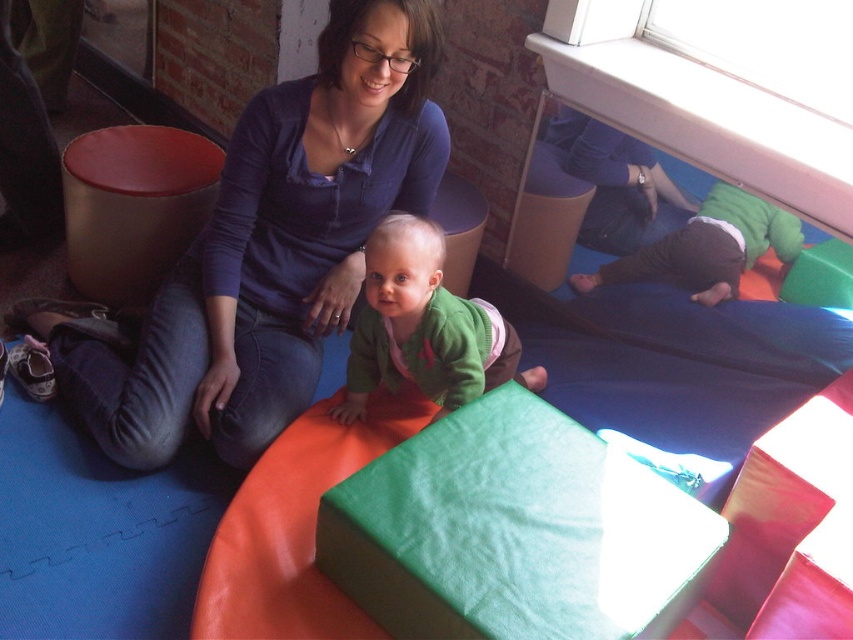
Question: Which is nearer to the green fabric cube at center?

Choices:
 (A) green fleece sweater at center
 (B) matte blue shirt at upper center
 (C) green fuzzy sweater at lower right

Answer: (C)

Question: Can you confirm if matte blue shirt at upper center is bigger than green fabric cube at center?

Choices:
 (A) no
 (B) yes

Answer: (B)

Question: Which object is the farthest from the green fleece sweater at center?

Choices:
 (A) green fabric cube at center
 (B) matte blue shirt at upper center

Answer: (A)

Question: Which of these objects is positioned farthest from the green fabric cube at center?

Choices:
 (A) matte blue shirt at upper center
 (B) green fuzzy sweater at lower right

Answer: (A)

Question: From the image, what is the correct spatial relationship of green fleece sweater at center in relation to green fuzzy sweater at lower right?

Choices:
 (A) right
 (B) left

Answer: (B)

Question: Does green fleece sweater at center come behind green fabric cube at center?

Choices:
 (A) yes
 (B) no

Answer: (B)